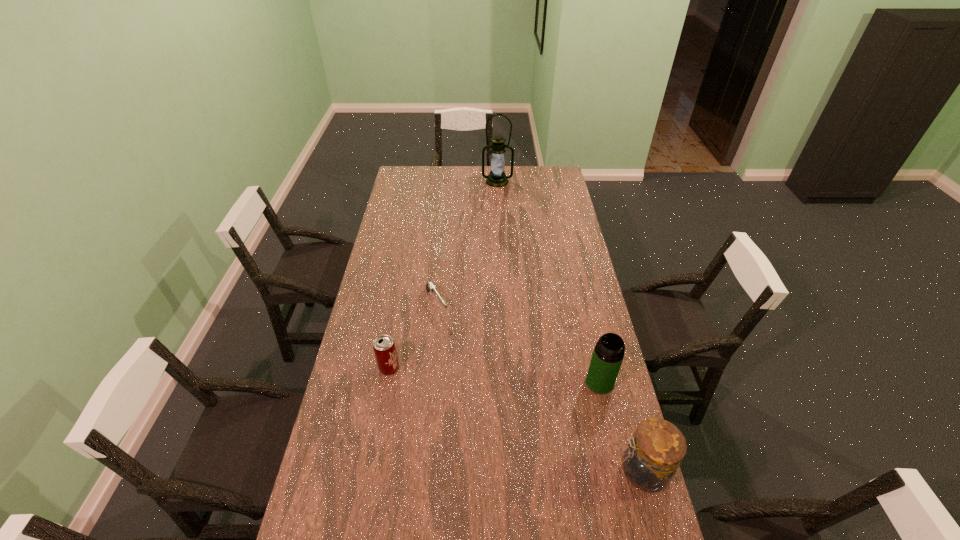
Locate an element on the screen. The height and width of the screenshot is (540, 960). vacant space at the far left corner of the desktop is located at coordinates (417, 169).

Where is `free space between the thermos bottle and the third object from left to right`? free space between the thermos bottle and the third object from left to right is located at coordinates coord(548,282).

Locate an element on the screen. vacant region between the third shortest object and the lantern is located at coordinates (569, 326).

At what (x,y) coordinates should I click in order to perform the action: click on free spot between the third tallest object and the second farthest object. Please return your answer as a coordinate pair (x, y). This screenshot has height=540, width=960. Looking at the image, I should click on (540, 387).

This screenshot has width=960, height=540. In order to click on vacant space that is in between the leftmost object and the second tallest object in this screenshot , I will do `click(494, 375)`.

The image size is (960, 540). What are the coordinates of `empty location between the second object from left to right and the third tallest object` in the screenshot? It's located at (540, 387).

Locate an element on the screen. This screenshot has width=960, height=540. vacant area between the second shortest object and the jar is located at coordinates (516, 420).

The height and width of the screenshot is (540, 960). I want to click on vacant region between the lantern and the pistol, so click(467, 242).

This screenshot has width=960, height=540. I want to click on vacant point located between the jar and the pistol, so [x=540, y=387].

You are a GUI agent. You are given a task and a screenshot of the screen. Output one action in this format:
    pyautogui.click(x=<x>, y=<y>)
    Task: Click on the blank region between the fourth shortest object and the leftmost object
    Image resolution: width=960 pixels, height=540 pixels.
    Given the screenshot: What is the action you would take?
    pyautogui.click(x=494, y=375)